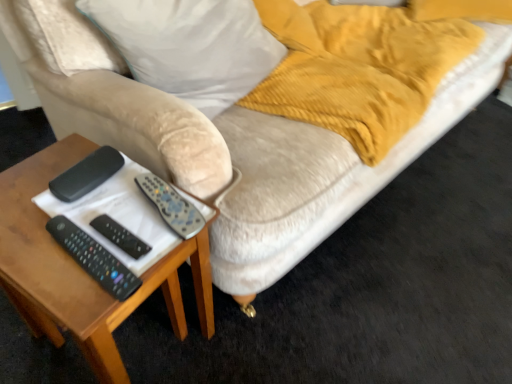
Identify the location of free space to the left of silver metallic remote at center, the first remote when ordered from top to bottom. (46, 218).